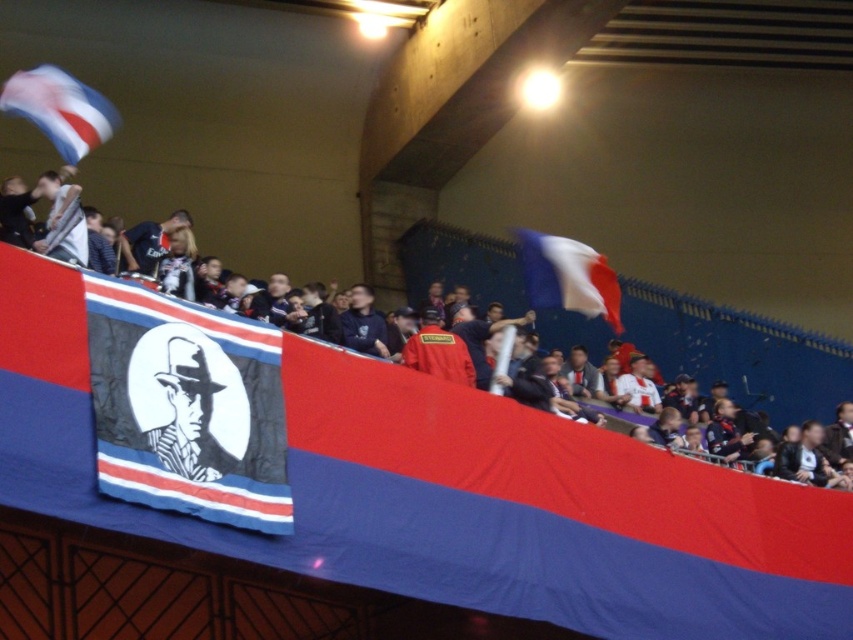
Can you confirm if white fabric flag at upper center is wider than black and white portrait at center?

Correct, the width of white fabric flag at upper center exceeds that of black and white portrait at center.

Between white fabric flag at upper center and black and white portrait at center, which one appears on the left side from the viewer's perspective?

black and white portrait at center

Is point (531, 280) positioned before point (152, 445)?

That is False.

Find the location of a particular element. The image size is (853, 640). white fabric flag at upper center is located at coordinates (567, 276).

Can you confirm if matte black banner at center is positioned above blue and white fabric flag at upper left?

Actually, matte black banner at center is below blue and white fabric flag at upper left.

Find the location of a particular element. The height and width of the screenshot is (640, 853). matte black banner at center is located at coordinates (740, 352).

Does point (109, 108) come behind point (201, 417)?

Yes, point (109, 108) is farther from viewer.

Does point (9, 108) come in front of point (178, 448)?

No, (9, 108) is behind (178, 448).

Locate an element on the screen. blue and white fabric flag at upper left is located at coordinates (61, 109).